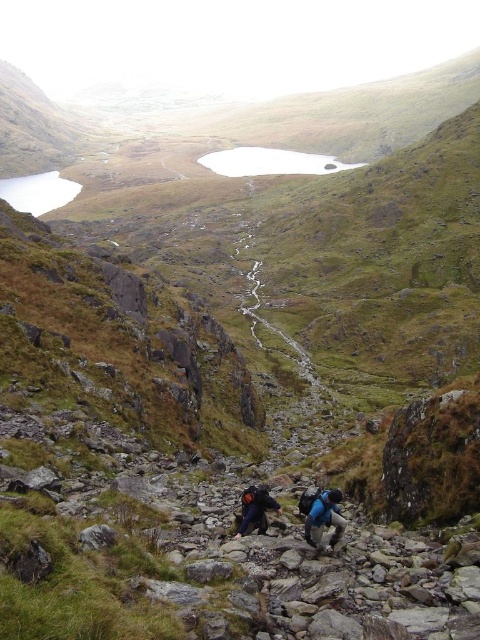
Question: Considering the relative positions of blue fabric backpacks at center and blue fabric backpack at lower center in the image provided, where is blue fabric backpacks at center located with respect to blue fabric backpack at lower center?

Choices:
 (A) below
 (B) above

Answer: (A)

Question: Can you confirm if clear water at center is thinner than dark blue backpack at center?

Choices:
 (A) no
 (B) yes

Answer: (A)

Question: Which of these objects is positioned farthest from the dark blue backpack at center?

Choices:
 (A) blue fabric backpacks at center
 (B) blue fabric backpack at lower center

Answer: (A)

Question: Which object is the farthest from the blue fabric backpacks at center?

Choices:
 (A) clear water at center
 (B) blue fabric backpack at lower center
 (C) dark blue backpack at center

Answer: (A)

Question: Can you confirm if clear water at center is smaller than dark blue backpack at center?

Choices:
 (A) yes
 (B) no

Answer: (B)

Question: Which of these objects is positioned farthest from the clear water at center?

Choices:
 (A) blue fabric backpacks at center
 (B) blue fabric backpack at lower center
 (C) dark blue backpack at center

Answer: (A)